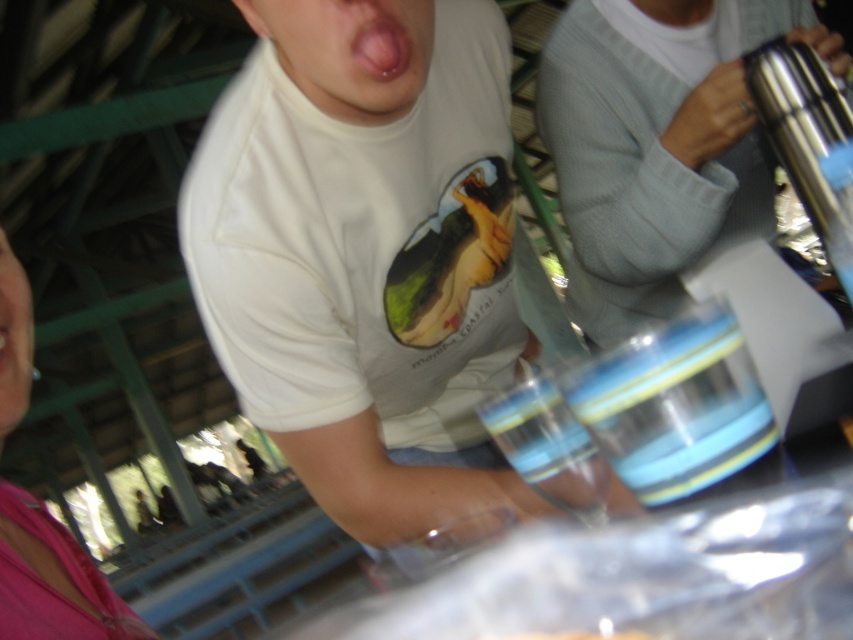
Between point (241, 204) and point (4, 333), which one is positioned behind?

Positioned behind is point (241, 204).

Looking at this image, does white matte t-shirt at center appear under dry skin at center?

Incorrect, white matte t-shirt at center is not positioned below dry skin at center.

Which is in front, point (294, 323) or point (1, 321)?

Positioned in front is point (1, 321).

Locate an element on the screen. white matte t-shirt at center is located at coordinates (364, 259).

Is metallic silver thermos at right below blue striped glass at center?

Actually, metallic silver thermos at right is above blue striped glass at center.

Does point (608, 225) come closer to viewer compared to point (653, 364)?

No, (608, 225) is further to viewer.

Is point (846, 52) positioned after point (660, 502)?

Yes, point (846, 52) is behind point (660, 502).

Find the location of a particular element. This screenshot has height=640, width=853. metallic silver thermos at right is located at coordinates pyautogui.click(x=659, y=144).

Is point (572, 106) closer to viewer compared to point (10, 355)?

No, it is not.

Is metallic silver thermos at right above dry skin at center?

Indeed, metallic silver thermos at right is positioned over dry skin at center.

Locate an element on the screen. The height and width of the screenshot is (640, 853). metallic silver thermos at right is located at coordinates (659, 144).

The height and width of the screenshot is (640, 853). I want to click on metallic silver thermos at right, so click(x=659, y=144).